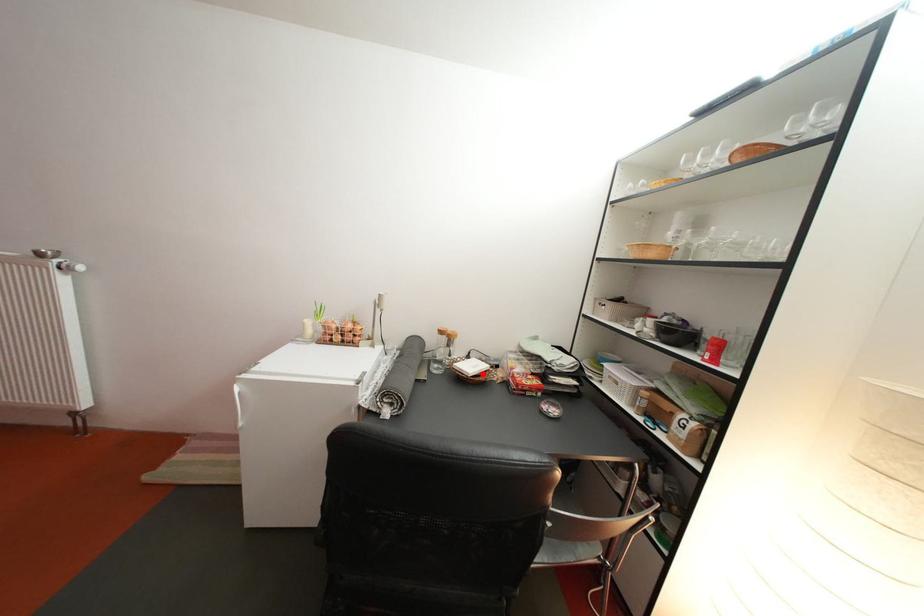
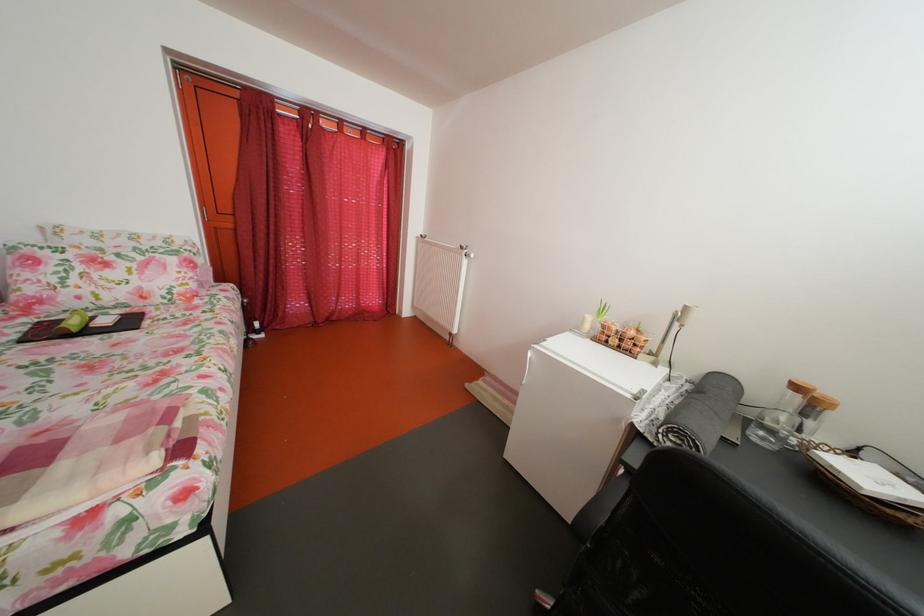
Find the pixel in the second image that matches the highlighted location in the first image.

(880, 485)